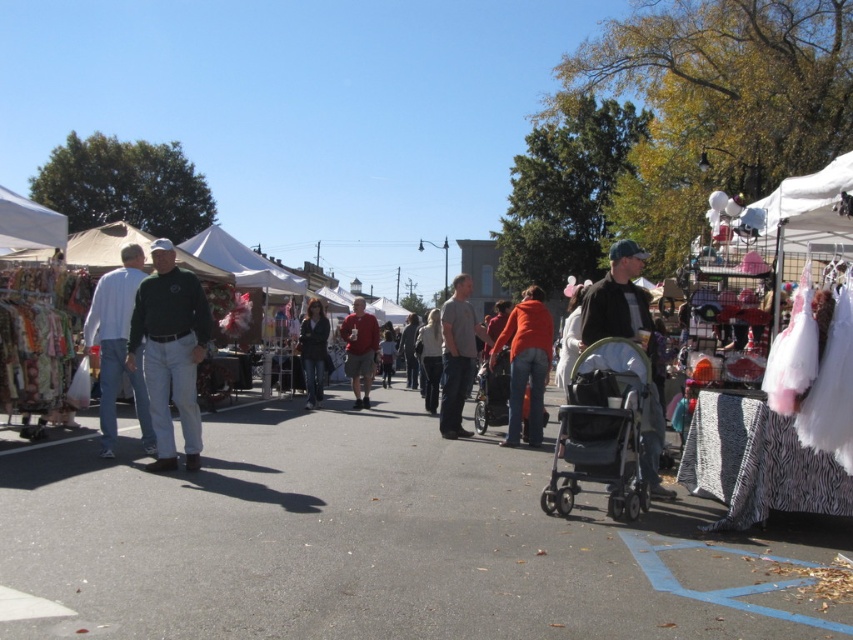
Question: Which point appears closest to the camera in this image?

Choices:
 (A) (445, 429)
 (B) (537, 330)
 (C) (634, 289)

Answer: (C)

Question: Can you confirm if orange cotton jacket at center is wider than matte red shirt at center?

Choices:
 (A) no
 (B) yes

Answer: (A)

Question: Does matte green jacket at center have a lesser width compared to gray cotton shirt at center?

Choices:
 (A) yes
 (B) no

Answer: (B)

Question: Which of these objects is positioned farthest from the matte green jacket at center?

Choices:
 (A) orange cotton jacket at center
 (B) dark gray fabric stroller at center
 (C) dark gray jacket at center

Answer: (C)

Question: Which point appears farthest from the camera in this image?

Choices:
 (A) (518, 422)
 (B) (646, 333)

Answer: (A)

Question: Is dark gray fabric stroller at center thinner than green jersey at center?

Choices:
 (A) no
 (B) yes

Answer: (A)